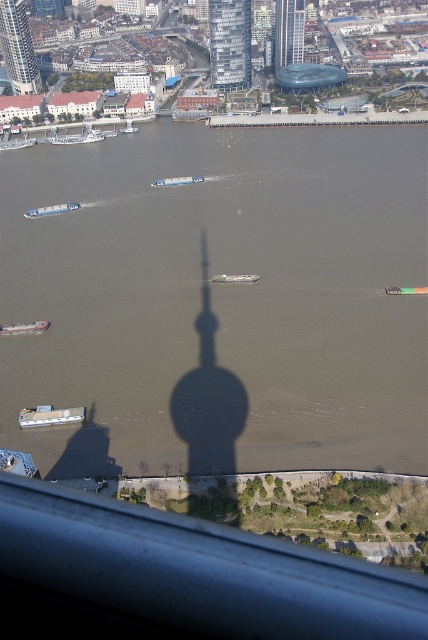
Between shiny glass tv tower at upper center and green matte barge at center, which one appears on the left side from the viewer's perspective?

green matte barge at center is more to the left.

Measure the distance between point (288, 16) and camera.

Point (288, 16) is 384.46 meters from camera.

Between point (300, 22) and point (222, 275), which one is positioned in front?

Positioned in front is point (222, 275).

Locate an element on the screen. shiny glass tv tower at upper center is located at coordinates (288, 33).

Is metallic gray boat at lower left positioned in front of white plastic boat at lower left?

Yes, metallic gray boat at lower left is closer to the viewer.

Does point (27, 417) lie behind point (32, 330)?

No, (27, 417) is in front of (32, 330).

Is point (50, 412) closer to camera compared to point (0, 333)?

Yes, point (50, 412) is in front of point (0, 333).

Find the location of `metallic gray boat at lower left`. metallic gray boat at lower left is located at coordinates (50, 416).

Can you confirm if metallic gray boat at lower left is shorter than green plastic boat at center?

No, metallic gray boat at lower left is not shorter than green plastic boat at center.

Does metallic gray boat at lower left appear under green plastic boat at center?

Yes.

Where is `metallic gray boat at lower left`? The image size is (428, 640). metallic gray boat at lower left is located at coordinates (50, 416).